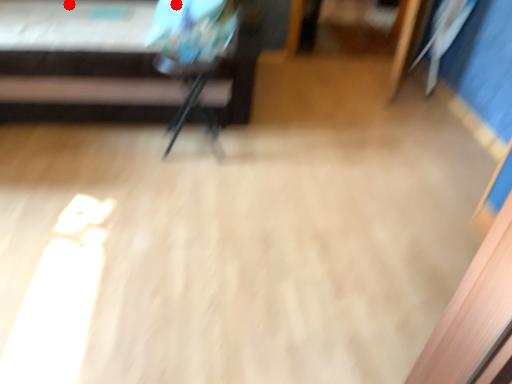
Question: Two points are circled on the image, labeled by A and B beside each circle. Among these points, which one is nearest to the camera?

Choices:
 (A) A is closer
 (B) B is closer

Answer: (A)